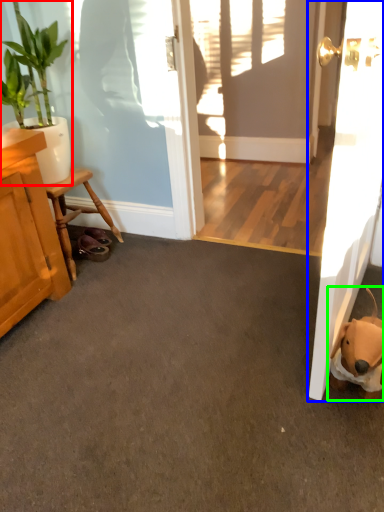
Question: Estimate the real-world distances between objects in this image. Which object is farther from houseplant (highlighted by a red box), door (highlighted by a blue box) or animal (highlighted by a green box)?

Choices:
 (A) door
 (B) animal

Answer: (B)